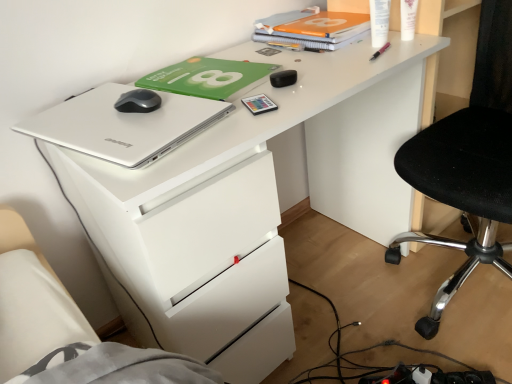
What are the coordinates of `free space that is in between white glossy lotion at upper right, the first stationery when ordered from right to left, and black matte earbuds at center, the fourth stationery viewed from the top` in the screenshot? It's located at (342, 60).